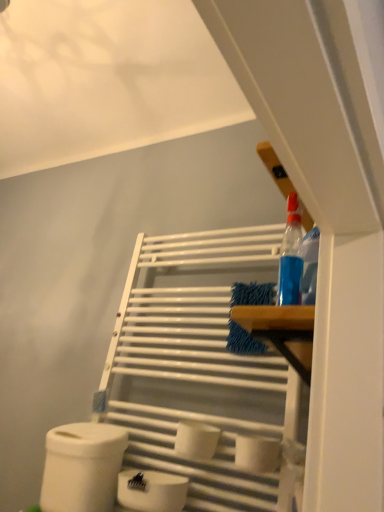
Question: Considering the relative sizes of white matte toilet paper at center, which ranks as the 4th toilet paper in left-to-right order, and white matte toilet paper at lower center, positioned as the second toilet paper in left-to-right order, in the image provided, is white matte toilet paper at center, which ranks as the 4th toilet paper in left-to-right order, smaller than white matte toilet paper at lower center, positioned as the second toilet paper in left-to-right order,?

Choices:
 (A) yes
 (B) no

Answer: (A)

Question: From a real-world perspective, is white matte toilet paper at center, which is the 1th toilet paper from right to left, over white matte toilet paper at lower center, positioned as the second toilet paper in left-to-right order?

Choices:
 (A) yes
 (B) no

Answer: (A)

Question: Is white matte toilet paper at center, which is the 1th toilet paper from right to left, shorter than white matte toilet paper at lower center, the 3th toilet paper in the right-to-left sequence?

Choices:
 (A) no
 (B) yes

Answer: (B)

Question: Is white matte toilet paper at center, which ranks as the 4th toilet paper in left-to-right order, facing away from white matte toilet paper at lower center, the 3th toilet paper in the right-to-left sequence?

Choices:
 (A) no
 (B) yes

Answer: (A)

Question: Is white matte toilet paper at center, which is the 1th toilet paper from right to left, bigger than white matte toilet paper at lower center, positioned as the second toilet paper in left-to-right order?

Choices:
 (A) yes
 (B) no

Answer: (B)

Question: Does point (66, 471) appear closer or farther from the camera than point (203, 424)?

Choices:
 (A) farther
 (B) closer

Answer: (A)

Question: Is white matte toilet paper at lower left, which is the 4th toilet paper from right to left, inside or outside of white matte toilet paper at center, which is counted as the second toilet paper, starting from the right?

Choices:
 (A) outside
 (B) inside

Answer: (A)

Question: In terms of height, does white matte toilet paper at lower left, which is the 4th toilet paper from right to left, look taller or shorter compared to white matte toilet paper at center, which is counted as the second toilet paper, starting from the right?

Choices:
 (A) tall
 (B) short

Answer: (A)

Question: Is white matte toilet paper at lower left, the 1th toilet paper viewed from the left, to the left or to the right of white matte toilet paper at center, which is the third toilet paper in left-to-right order, in the image?

Choices:
 (A) right
 (B) left

Answer: (B)

Question: In terms of height, does white matte toilet paper at center, which is the 1th toilet paper from right to left, look taller or shorter compared to white matte toilet paper at lower center, positioned as the second toilet paper in left-to-right order?

Choices:
 (A) short
 (B) tall

Answer: (A)

Question: Considering the positions of point (248, 466) and point (134, 489), is point (248, 466) closer or farther from the camera than point (134, 489)?

Choices:
 (A) farther
 (B) closer

Answer: (B)

Question: From the image's perspective, is white matte toilet paper at center, which ranks as the 4th toilet paper in left-to-right order, above or below white matte toilet paper at lower center, the 3th toilet paper in the right-to-left sequence?

Choices:
 (A) above
 (B) below

Answer: (A)

Question: From a real-world perspective, is white matte toilet paper at center, which is the 1th toilet paper from right to left, above or below white matte toilet paper at lower center, the 3th toilet paper in the right-to-left sequence?

Choices:
 (A) above
 (B) below

Answer: (A)

Question: From the image's perspective, relative to white matte toilet paper at lower left, the 1th toilet paper viewed from the left, is white matte toilet paper at center, which is the third toilet paper in left-to-right order, above or below?

Choices:
 (A) below
 (B) above

Answer: (B)

Question: Relative to white matte toilet paper at lower left, which is the 4th toilet paper from right to left, is white matte toilet paper at center, which is counted as the second toilet paper, starting from the right, in front or behind?

Choices:
 (A) front
 (B) behind

Answer: (A)